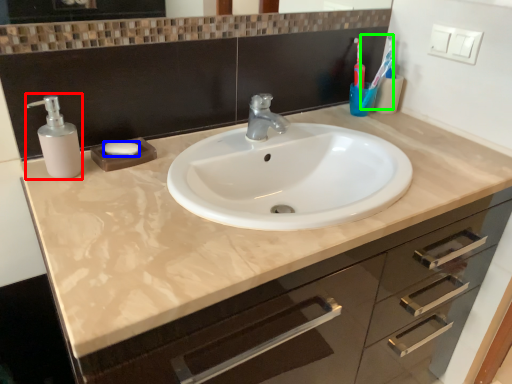
Question: Which is farther away from soap dispenser (highlighted by a red box)? soap (highlighted by a blue box) or toothbrush (highlighted by a green box)?

Choices:
 (A) soap
 (B) toothbrush

Answer: (B)